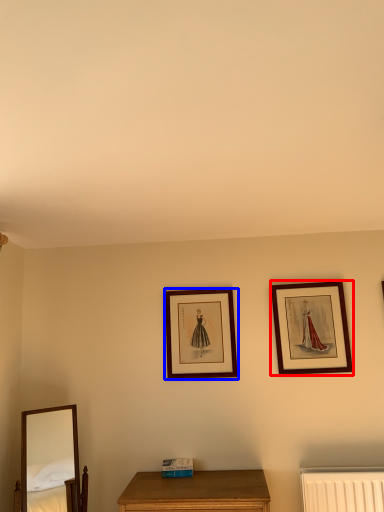
Question: Which of the following is the farthest to the observer, picture frame (highlighted by a red box) or picture frame (highlighted by a blue box)?

Choices:
 (A) picture frame
 (B) picture frame

Answer: (B)